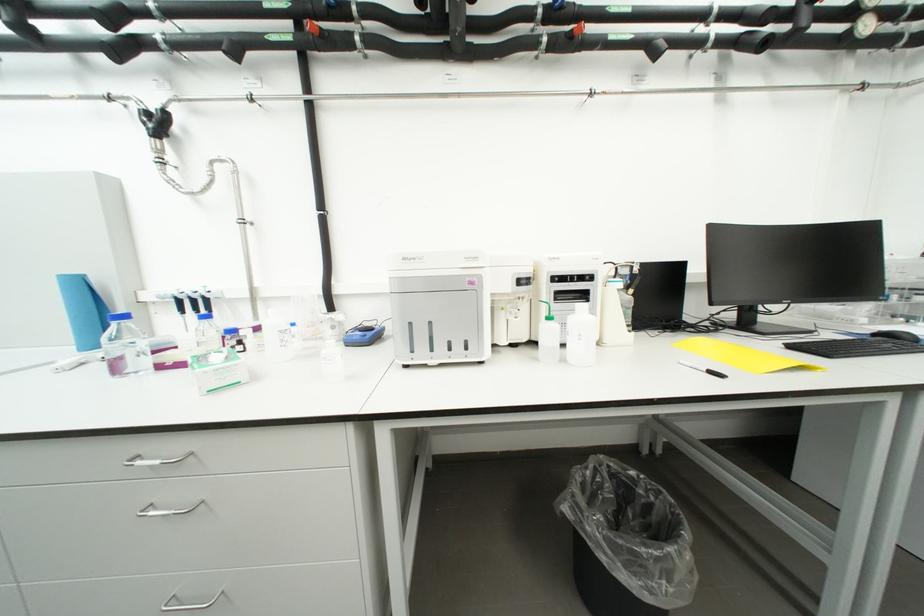
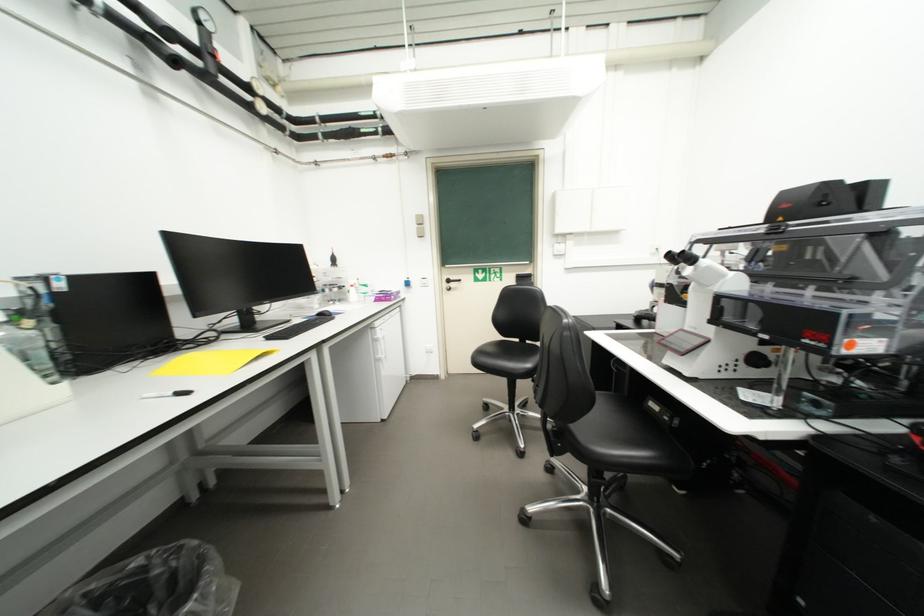
Question: How did the camera likely rotate?

Choices:
 (A) Left
 (B) Right
 (C) Up
 (D) Down

Answer: (B)